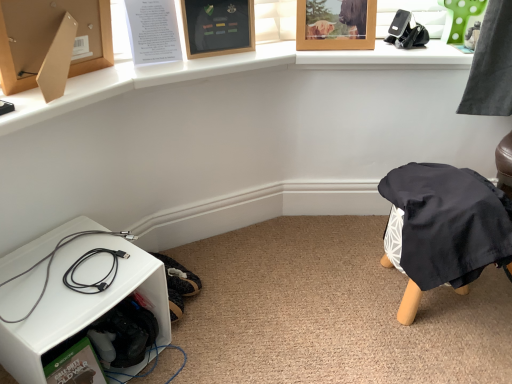
Question: Is wooden picture frame at upper center, the first picture frame positioned from the left, to the left or to the right of white plastic shelf at lower left in the image?

Choices:
 (A) right
 (B) left

Answer: (A)

Question: Is wooden picture frame at upper center, the first picture frame positioned from the left, wider or thinner than white plastic shelf at lower left?

Choices:
 (A) wide
 (B) thin

Answer: (B)

Question: Based on their relative distances, which object is farther from the wooden picture frame at upper center, the first picture frame when ordered from right to left?

Choices:
 (A) black plastic phone holder at upper right
 (B) white plastic shelf at lower left
 (C) wooden picture frame at upper center, the 2th picture frame when ordered from right to left
 (D) black cable at lower left

Answer: (B)

Question: Which is farther from the black cable at lower left?

Choices:
 (A) wooden picture frame at upper center, positioned as the 2th picture frame in left-to-right order
 (B) black plastic phone holder at upper right
 (C) wooden picture frame at upper center, the 2th picture frame when ordered from right to left
 (D) white plastic shelf at lower left

Answer: (B)